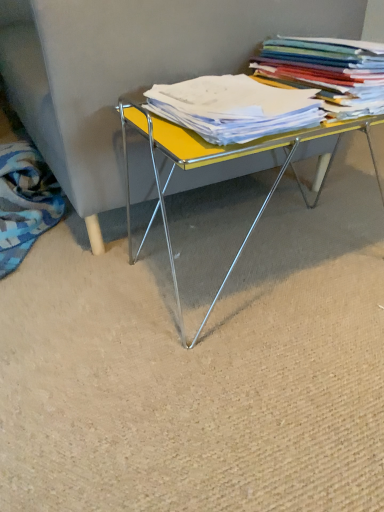
Question: From a real-world perspective, is multicolored paper stack at upper right on blue patterned fabric at lower left?

Choices:
 (A) no
 (B) yes

Answer: (B)

Question: Does multicolored paper stack at upper right have a smaller size compared to blue patterned fabric at lower left?

Choices:
 (A) yes
 (B) no

Answer: (A)

Question: Is multicolored paper stack at upper right thinner than blue patterned fabric at lower left?

Choices:
 (A) no
 (B) yes

Answer: (B)

Question: Does multicolored paper stack at upper right appear on the right side of blue patterned fabric at lower left?

Choices:
 (A) yes
 (B) no

Answer: (A)

Question: From the image's perspective, would you say multicolored paper stack at upper right is shown under blue patterned fabric at lower left?

Choices:
 (A) no
 (B) yes

Answer: (A)

Question: Is multicolored paper stack at upper right not within blue patterned fabric at lower left?

Choices:
 (A) yes
 (B) no

Answer: (A)

Question: Is multicolored paper stack at upper right at the back of yellow matte paper at center?

Choices:
 (A) yes
 (B) no

Answer: (B)

Question: Is yellow matte paper at center at the left side of multicolored paper stack at upper right?

Choices:
 (A) yes
 (B) no

Answer: (A)

Question: Can you confirm if yellow matte paper at center is wider than multicolored paper stack at upper right?

Choices:
 (A) no
 (B) yes

Answer: (A)

Question: Can you confirm if yellow matte paper at center is bigger than multicolored paper stack at upper right?

Choices:
 (A) yes
 (B) no

Answer: (B)

Question: Would you say yellow matte paper at center is outside multicolored paper stack at upper right?

Choices:
 (A) no
 (B) yes

Answer: (B)

Question: Can you confirm if yellow matte paper at center is positioned to the right of multicolored paper stack at upper right?

Choices:
 (A) no
 (B) yes

Answer: (A)

Question: Considering the relative sizes of blue patterned fabric at lower left and multicolored paper stack at upper right in the image provided, is blue patterned fabric at lower left wider than multicolored paper stack at upper right?

Choices:
 (A) yes
 (B) no

Answer: (A)